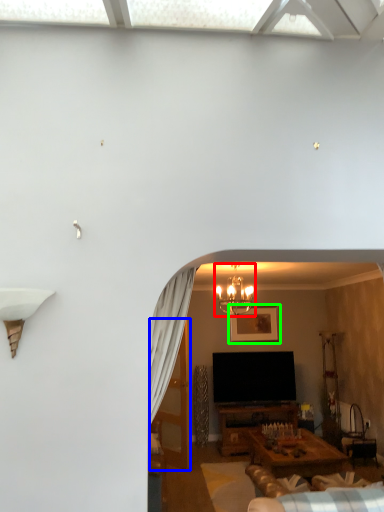
Question: Which object is the farthest from light fixture (highlighted by a red box)? Choose among these: glass door (highlighted by a blue box) or picture frame (highlighted by a green box).

Choices:
 (A) glass door
 (B) picture frame

Answer: (A)